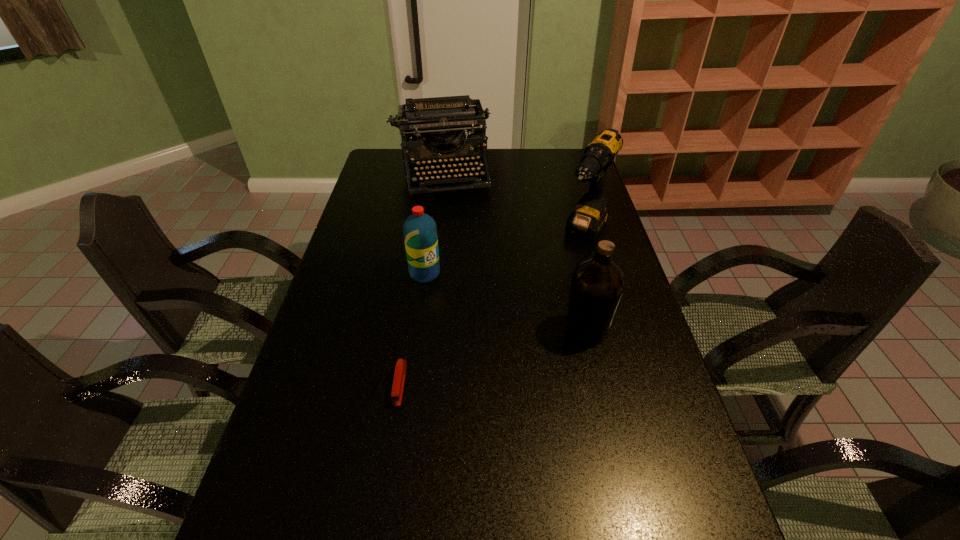
This screenshot has width=960, height=540. I want to click on free space that is in between the shortest object and the third farthest object, so click(413, 329).

This screenshot has width=960, height=540. I want to click on vacant area that lies between the second nearest object and the stapler, so click(493, 357).

Identify which object is the third closest to the second farthest object. Please provide its 2D coordinates. Your answer should be formatted as a tuple, i.e. [(x, y)], where the tuple contains the x and y coordinates of a point satisfying the conditions above.

[(420, 232)]

Where is `object that stands as the second closest to the typewriter`? The image size is (960, 540). object that stands as the second closest to the typewriter is located at coordinates (420, 232).

Locate an element on the screen. Image resolution: width=960 pixels, height=540 pixels. free spot that satisfies the following two spatial constraints: 1. on the front side of the olive oil; 2. on the label of the farthest object is located at coordinates (421, 330).